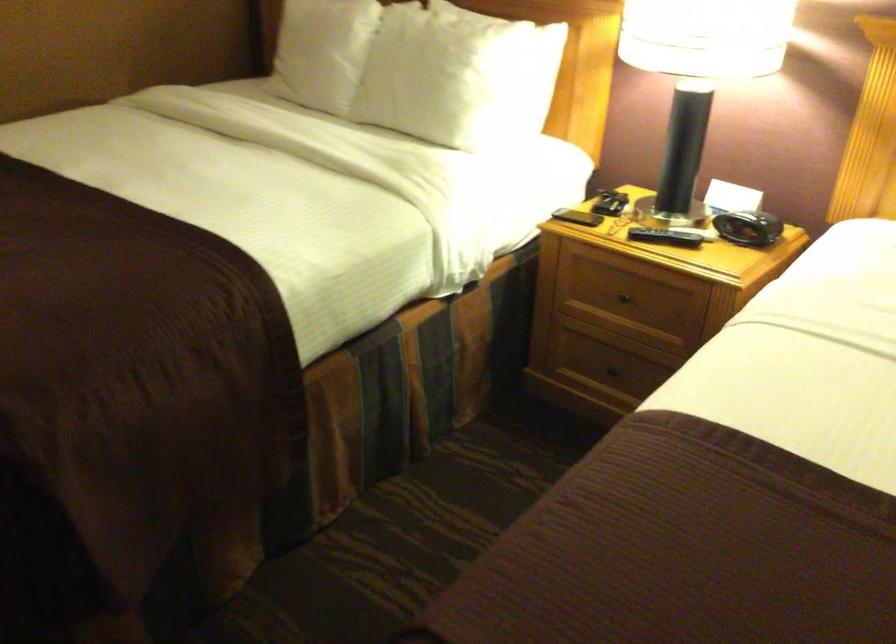
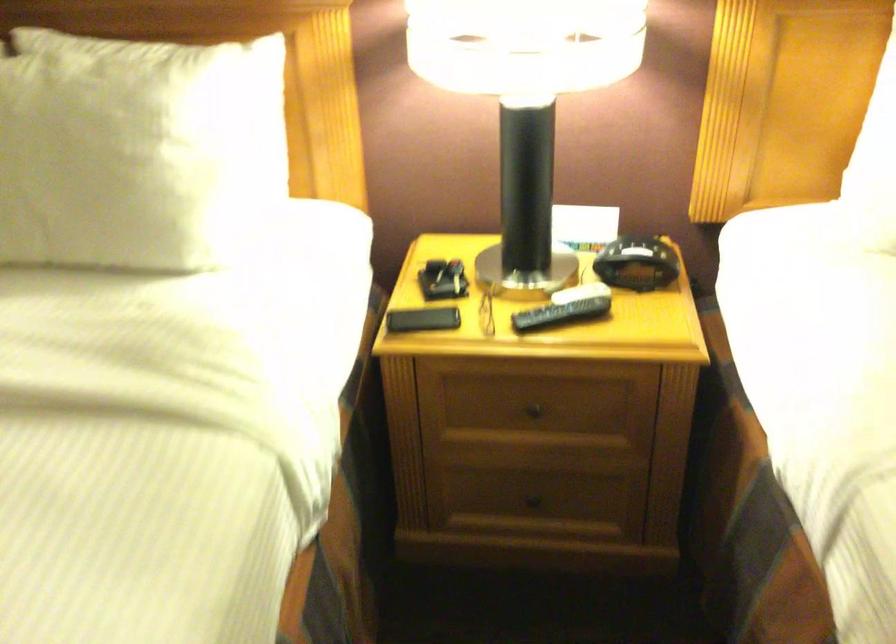
In the second image, find the point that corresponds to (618,379) in the first image.

(538, 500)